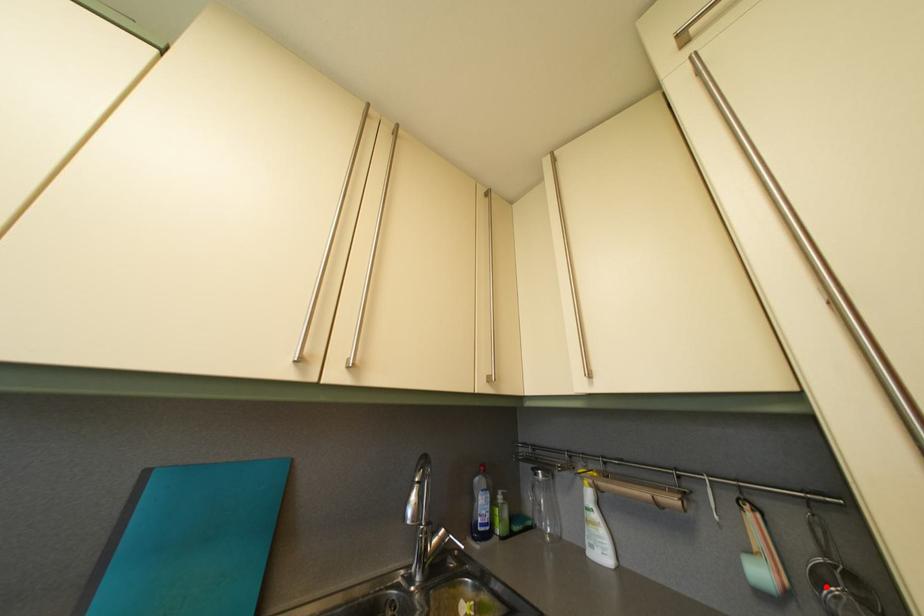
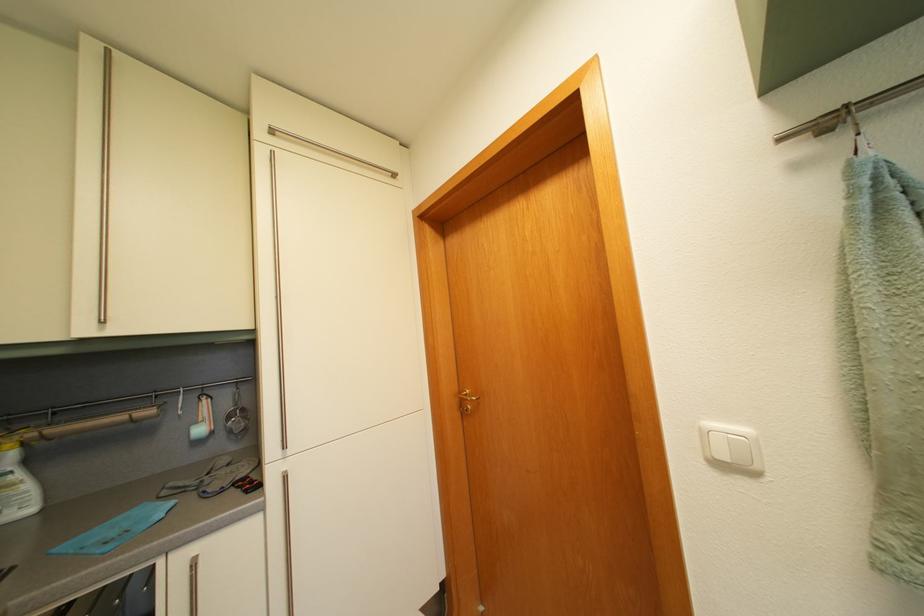
Question: I am providing you with two images of the same scene from different viewpoints. A red point is shown in image1. For the corresponding object point in image2, is it positioned nearer or farther from the camera?

Choices:
 (A) Nearer
 (B) Farther

Answer: (B)